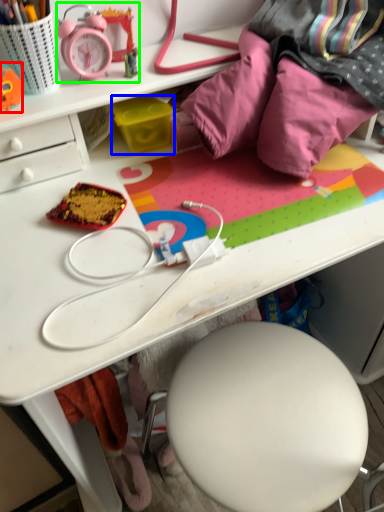
Question: Which object is the closest to the toy (highlighted by a red box)? Choose among these: stationery (highlighted by a blue box) or stationery (highlighted by a green box).

Choices:
 (A) stationery
 (B) stationery

Answer: (B)